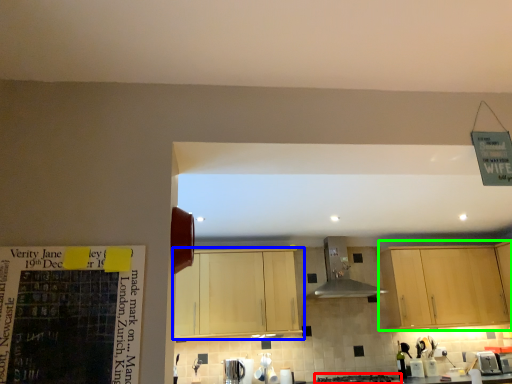
Question: Which object is the farthest from gas stove (highlighted by a red box)? Choose among these: cabinetry (highlighted by a blue box) or cabinetry (highlighted by a green box).

Choices:
 (A) cabinetry
 (B) cabinetry

Answer: (A)